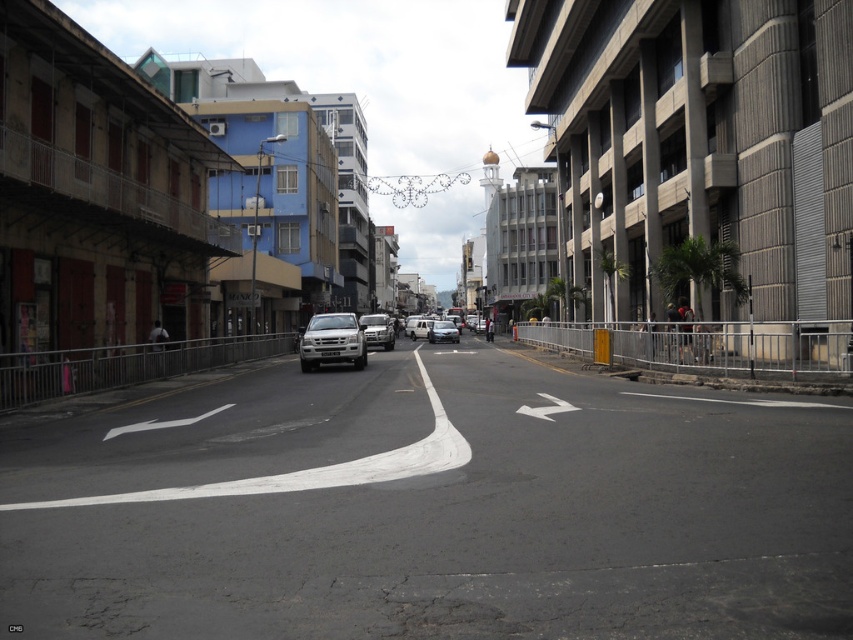
From the picture: Can you confirm if silver metallic suv at center is shorter than silver metallic car at center?

Incorrect, silver metallic suv at center's height does not fall short of silver metallic car at center's.

Is silver metallic suv at center behind silver metallic car at center?

No, it is in front of silver metallic car at center.

Which is in front, point (334, 337) or point (368, 339)?

Positioned in front is point (334, 337).

I want to click on silver metallic suv at center, so click(332, 340).

Does metallic silver car at center appear on the right side of white matte van at center?

Yes, metallic silver car at center is to the right of white matte van at center.

The width and height of the screenshot is (853, 640). Describe the element at coordinates (444, 332) in the screenshot. I see `metallic silver car at center` at that location.

At what (x,y) coordinates should I click in order to perform the action: click on metallic silver car at center. Please return your answer as a coordinate pair (x, y). The height and width of the screenshot is (640, 853). Looking at the image, I should click on (444, 332).

Where is `white asphalt curve at center`? The image size is (853, 640). white asphalt curve at center is located at coordinates (312, 468).

Can you confirm if white asphalt curve at center is positioned above metallic silver car at center?

Incorrect, white asphalt curve at center is not positioned above metallic silver car at center.

I want to click on white asphalt curve at center, so click(x=312, y=468).

Identify the location of white asphalt curve at center. (312, 468).